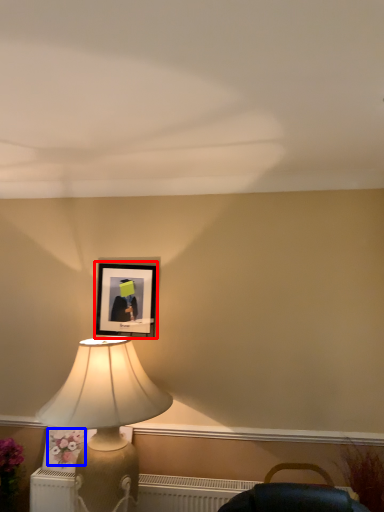
Question: Among these objects, which one is farthest to the camera, picture frame (highlighted by a red box) or flower (highlighted by a blue box)?

Choices:
 (A) picture frame
 (B) flower

Answer: (A)